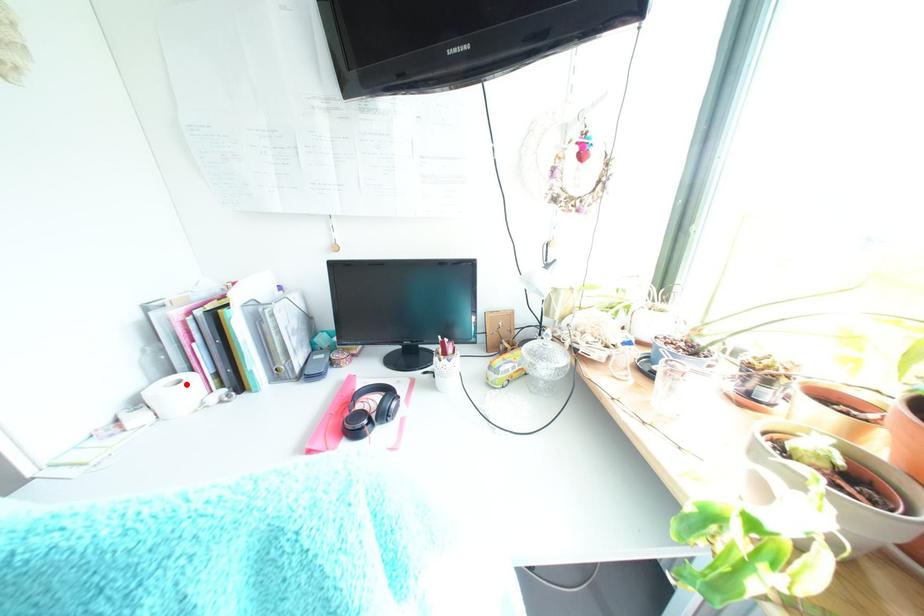
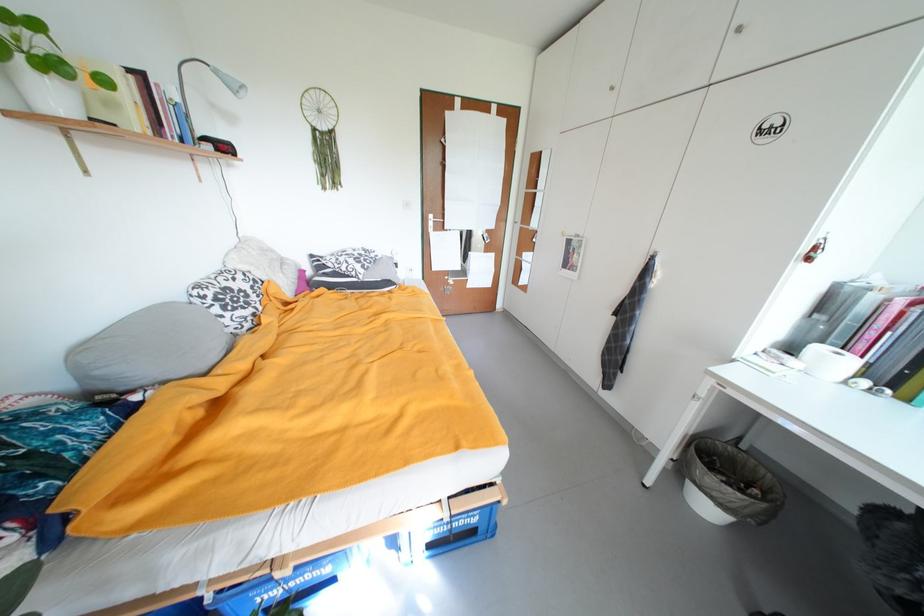
Locate, in the second image, the point that corresponds to the highlighted location in the first image.

(845, 355)